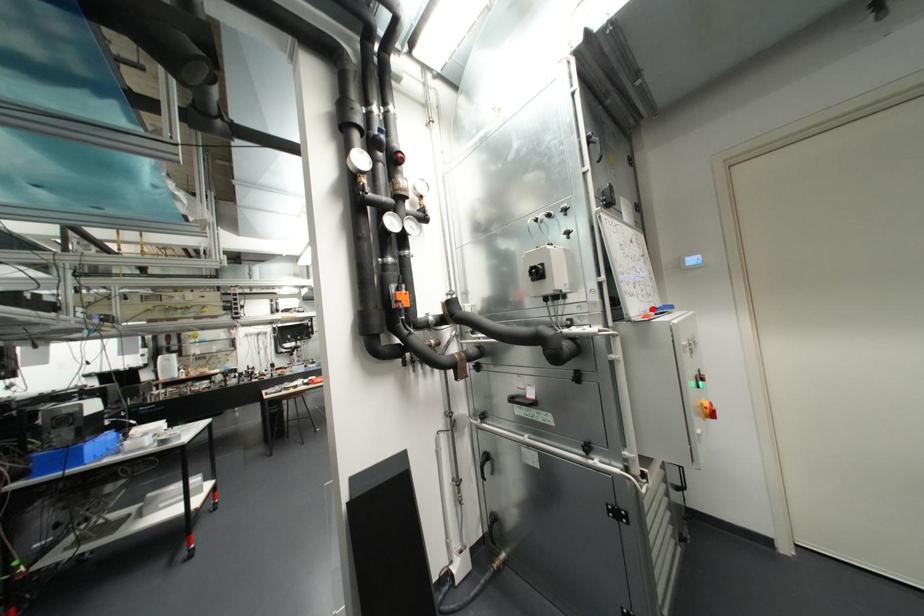
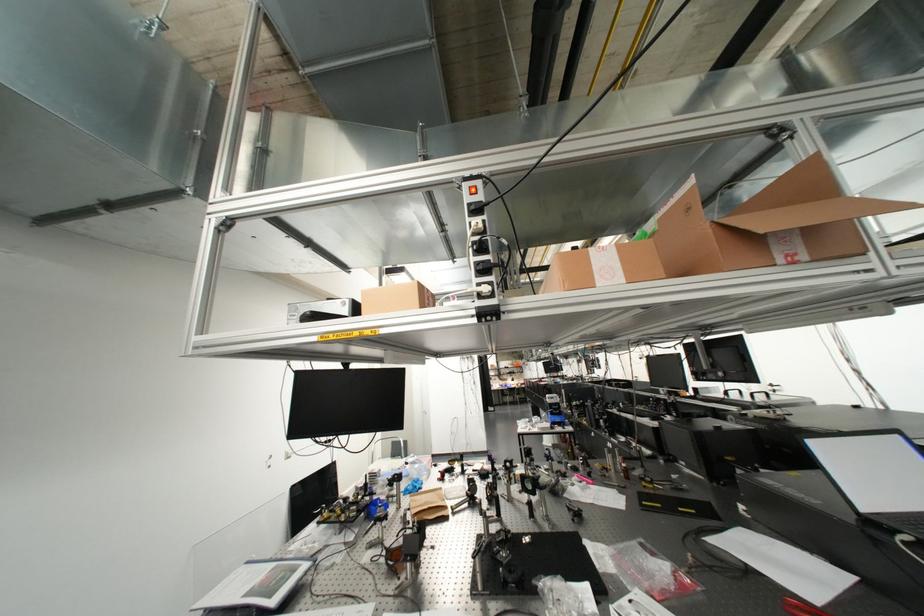
Question: I am providing you with two images of the same scene from different viewpoints. A red point is marked on the first image. Is the red point's position out of view in image 2?

Choices:
 (A) Yes
 (B) No

Answer: (A)